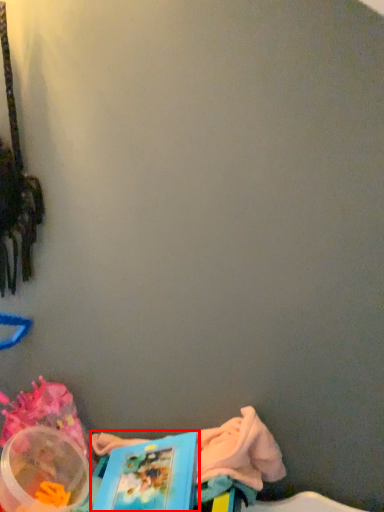
Question: From the image, what is the correct spatial relationship of book (annotated by the red box) in relation to storage box?

Choices:
 (A) left
 (B) right

Answer: (B)